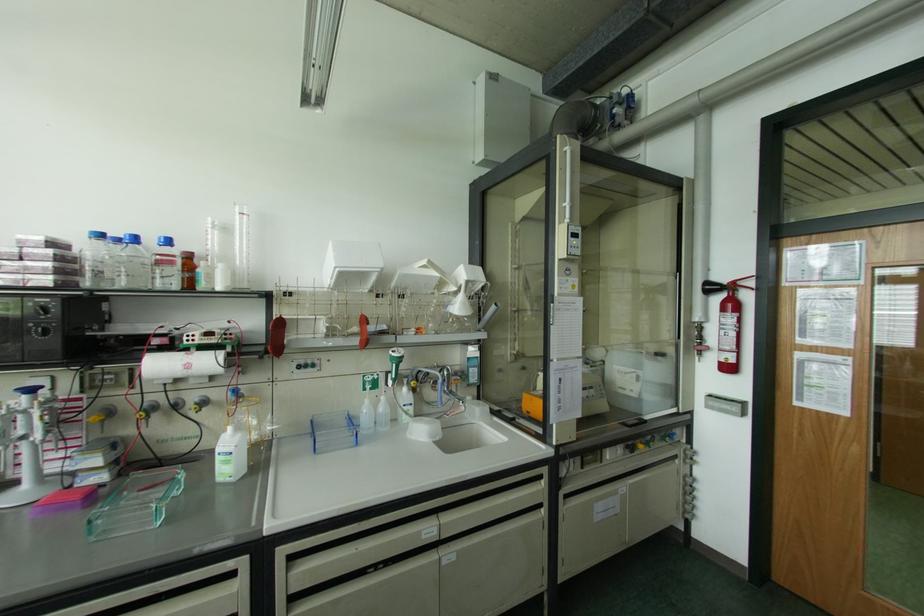
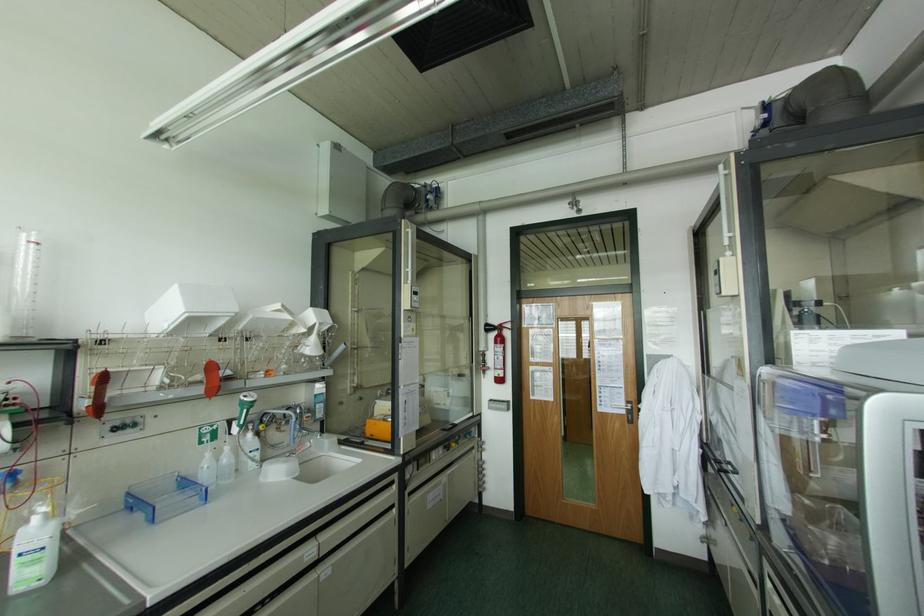
Find the pixel in the second image that matches [363,321] in the first image.

(211, 368)